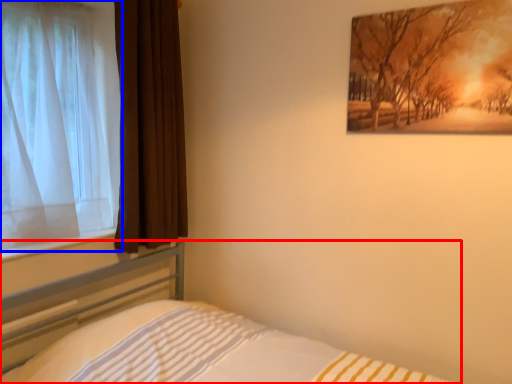
Question: Which point is further to the camera, bed (highlighted by a red box) or curtain (highlighted by a blue box)?

Choices:
 (A) bed
 (B) curtain

Answer: (B)